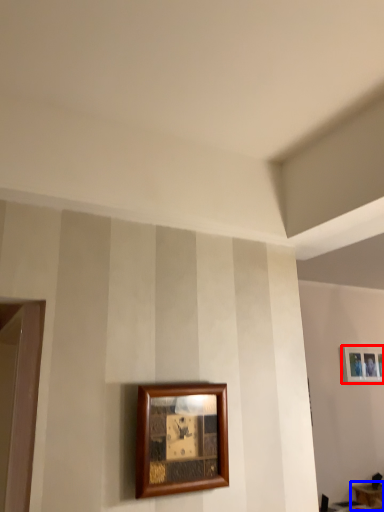
Question: Which of the following is the closest to the observer, picture frame (highlighted by a red box) or table (highlighted by a blue box)?

Choices:
 (A) picture frame
 (B) table

Answer: (B)